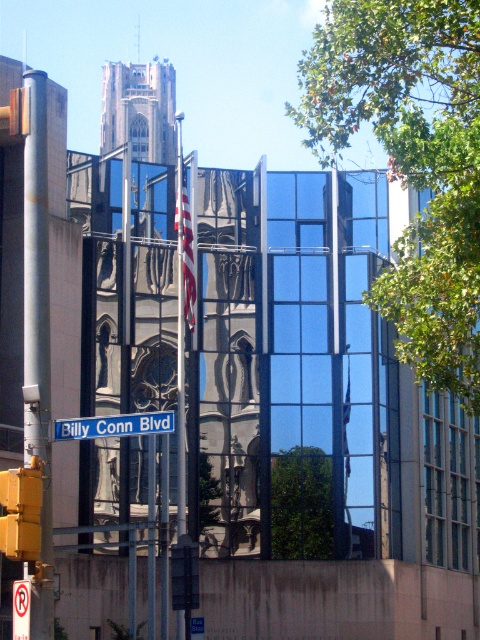
Question: Where is green leafy tree at upper right located in relation to yellow matte traffic light at lower left in the image?

Choices:
 (A) below
 (B) above

Answer: (B)

Question: Which point is closer to the camera?

Choices:
 (A) metallic pole at center
 (B) blue plastic street sign at center
 (C) yellow matte traffic light at lower left
 (D) green leafy tree at center

Answer: (C)

Question: Which object appears farthest from the camera in this image?

Choices:
 (A) green leafy tree at upper right
 (B) metallic pole at center

Answer: (B)

Question: Is metallic pole at center above blue plastic street sign at center?

Choices:
 (A) no
 (B) yes

Answer: (B)

Question: Which object is closer to the camera taking this photo?

Choices:
 (A) green leafy tree at upper right
 (B) blue plastic street sign at center
 (C) metallic pole at center
 (D) green leafy tree at center

Answer: (B)

Question: From the image, what is the correct spatial relationship of green leafy tree at upper right in relation to blue plastic street sign at center?

Choices:
 (A) right
 (B) left

Answer: (A)